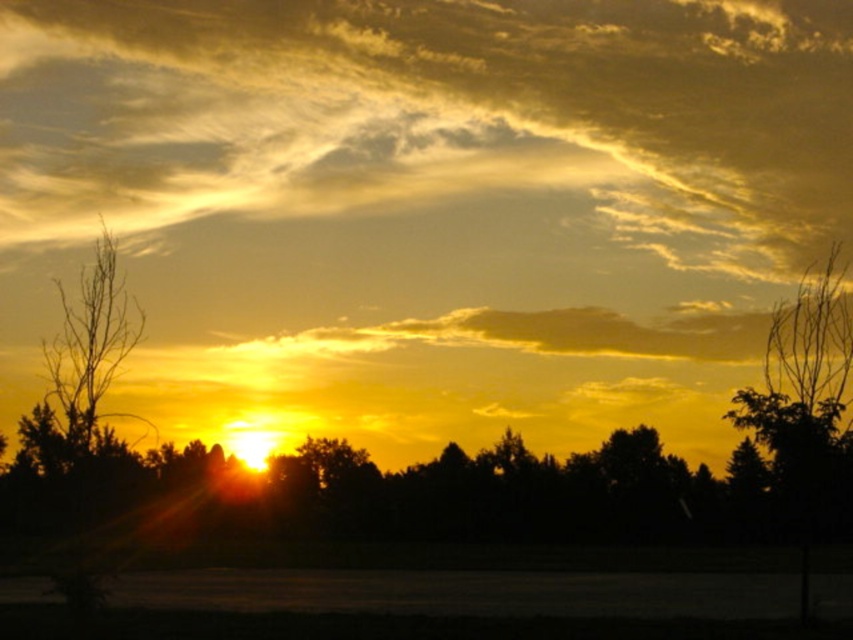
Looking at this image, you are standing in the field and see two points in the sunset scene. The first point is at coordinates point (670, 84) and the second is at point (74, 362). Which point is closer to you?

Point (74, 362) is closer to you because it is in front of point (670, 84) according to their spatial arrangement.